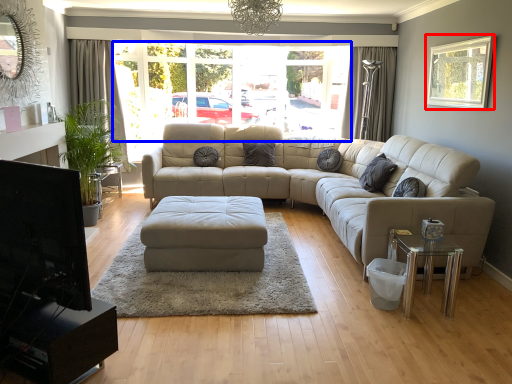
Question: Which object appears farthest to the camera in this image, window (highlighted by a red box) or window frame (highlighted by a blue box)?

Choices:
 (A) window
 (B) window frame

Answer: (B)